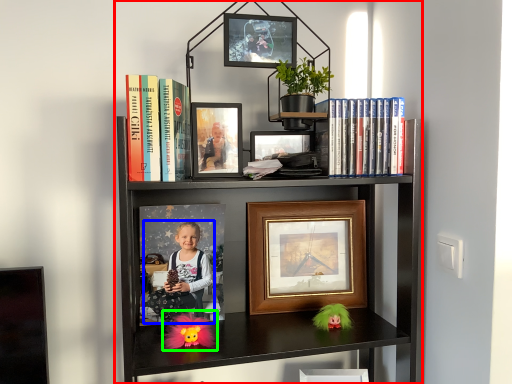
Question: Considering the real-world distances, which object is closest to bookcase (highlighted by a red box)? person (highlighted by a blue box) or doll (highlighted by a green box).

Choices:
 (A) person
 (B) doll

Answer: (A)